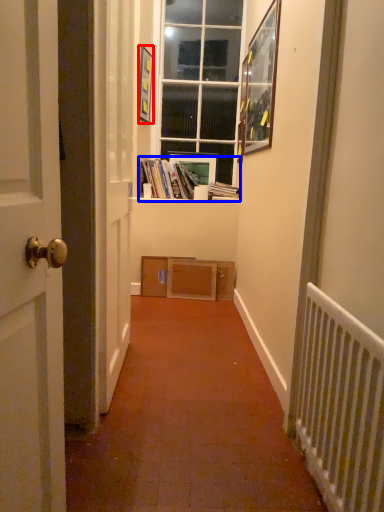
Question: Which object is closer to the camera taking this photo, picture frame (highlighted by a red box) or book (highlighted by a blue box)?

Choices:
 (A) picture frame
 (B) book

Answer: (A)